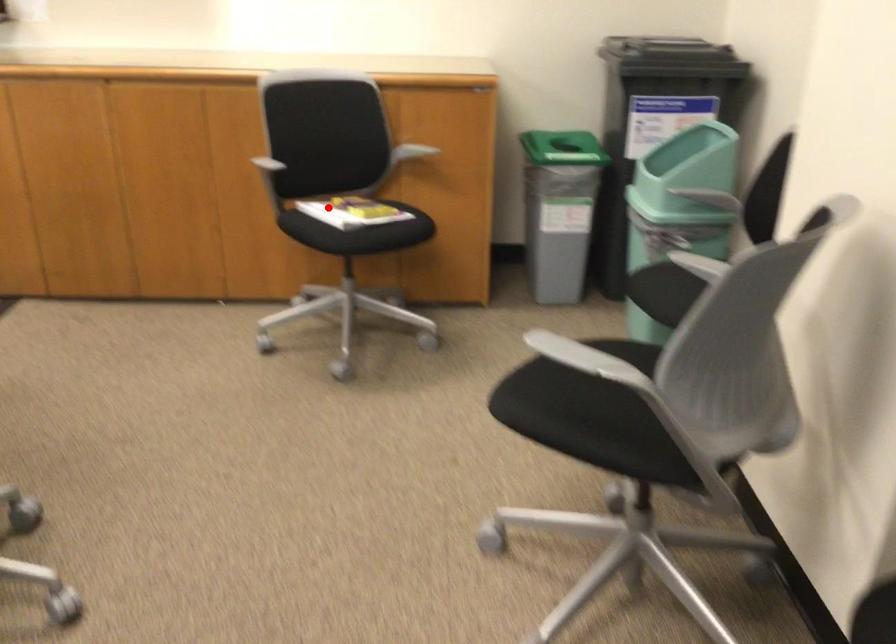
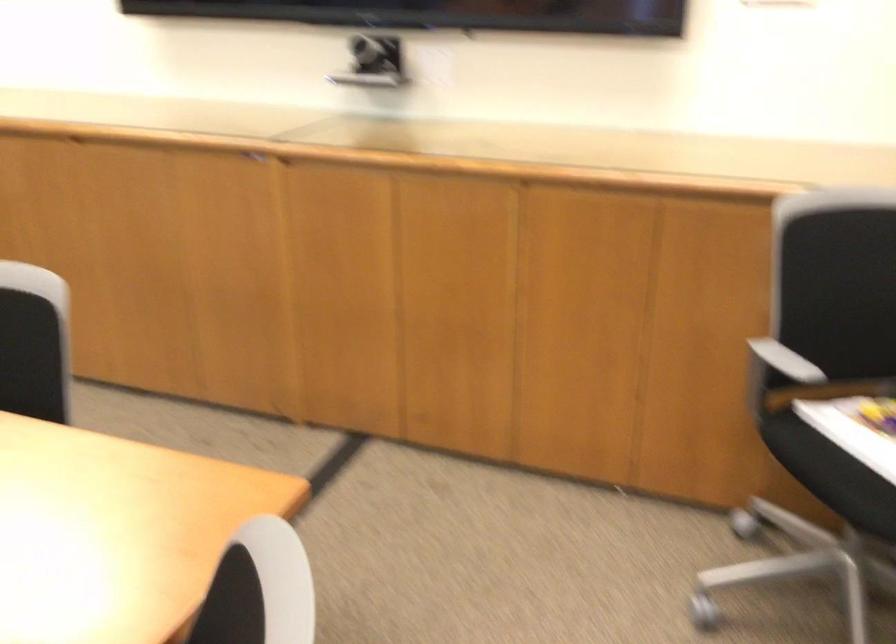
Where in the second image is the point corresponding to the highlighted location from the first image?

(857, 428)